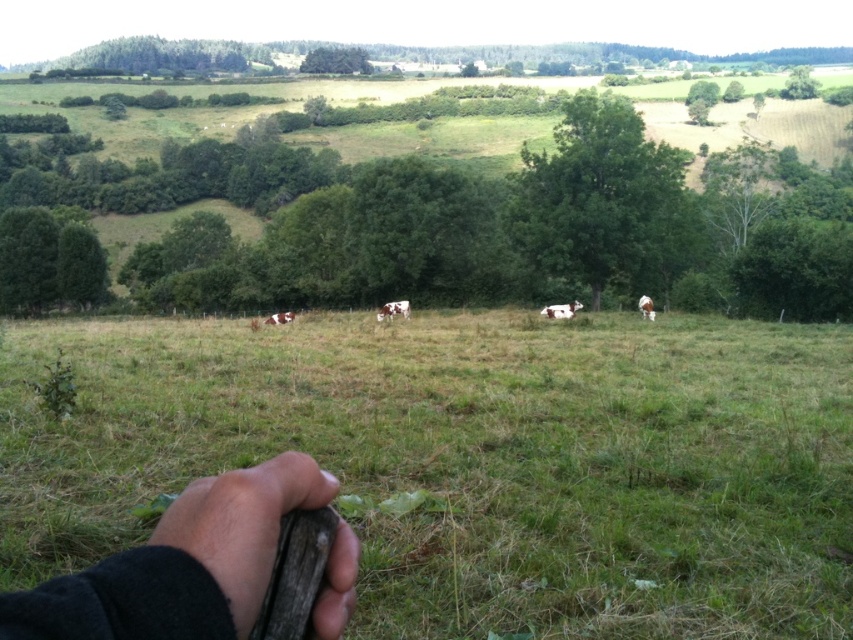
Does point (160, 339) lie in front of point (395, 310)?

Yes.

Who is higher up, green grassy field at center or brown and white fur at center?

Positioned higher is brown and white fur at center.

Image resolution: width=853 pixels, height=640 pixels. Find the location of `green grassy field at center`. green grassy field at center is located at coordinates (469, 461).

Is point (834, 538) in front of point (576, 301)?

Yes, point (834, 538) is in front of point (576, 301).

The height and width of the screenshot is (640, 853). I want to click on green grassy field at center, so tap(469, 461).

Which is above, white speckled cow at center or brown speckled cow at right?

white speckled cow at center

Does point (573, 308) come in front of point (646, 301)?

Yes.

In order to click on white speckled cow at center in this screenshot , I will do `click(561, 308)`.